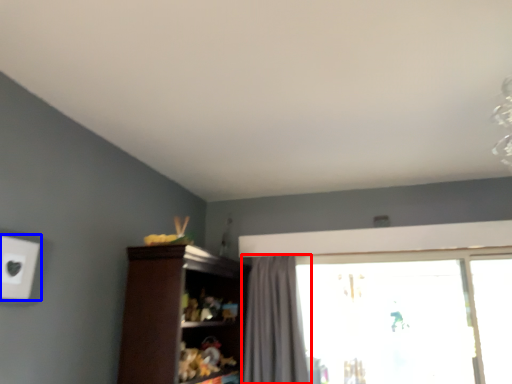
Question: Which object appears closest to the camera in this image, curtain (highlighted by a red box) or electric outlet (highlighted by a blue box)?

Choices:
 (A) curtain
 (B) electric outlet

Answer: (B)